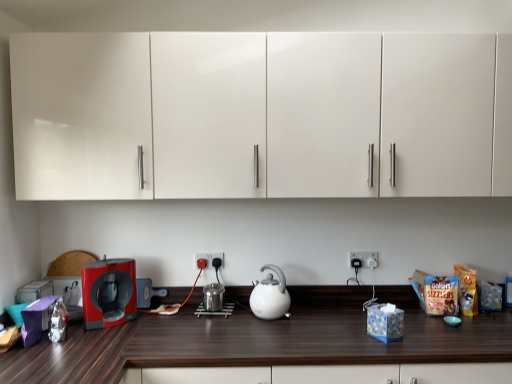
The width and height of the screenshot is (512, 384). What do you see at coordinates (209, 258) in the screenshot?
I see `black plastic electric outlet at center, the first electric outlet viewed from the left` at bounding box center [209, 258].

What do you see at coordinates (261, 115) in the screenshot? The height and width of the screenshot is (384, 512). I see `white glossy cabinets at upper center` at bounding box center [261, 115].

This screenshot has width=512, height=384. What do you see at coordinates (270, 295) in the screenshot? I see `white glossy kettle at center` at bounding box center [270, 295].

Where is `white glossy kettle at center`? This screenshot has height=384, width=512. white glossy kettle at center is located at coordinates 270,295.

This screenshot has height=384, width=512. What do you see at coordinates (364, 258) in the screenshot? I see `white plastic electric outlet at center, marked as the 1th electric outlet in a right-to-left arrangement` at bounding box center [364, 258].

The image size is (512, 384). In order to click on dark wood countertop at lower center in this screenshot , I will do 262,339.

The width and height of the screenshot is (512, 384). In order to click on red glossy coffee machine at left in this screenshot , I will do `click(109, 292)`.

Locate an element on the screen. The height and width of the screenshot is (384, 512). black plastic electric outlet at center, marked as the second electric outlet in a right-to-left arrangement is located at coordinates (209, 258).

From the image's perspective, does white glossy kettle at center appear lower than red glossy coffee machine at left?

Yes, from the image's perspective, white glossy kettle at center is beneath red glossy coffee machine at left.

Which object is thinner, white glossy kettle at center or red glossy coffee machine at left?

red glossy coffee machine at left.

Can you confirm if white glossy kettle at center is positioned to the left of red glossy coffee machine at left?

No, white glossy kettle at center is not to the left of red glossy coffee machine at left.

From a real-world perspective, between white glossy kettle at center and red glossy coffee machine at left, who is vertically higher?

red glossy coffee machine at left.

Between white glossy cabinets at upper center and white glossy kettle at center, which one is positioned in front?

white glossy cabinets at upper center is closer to the camera.

From the picture: From a real-world perspective, relative to white glossy kettle at center, is white glossy cabinets at upper center vertically above or below?

white glossy cabinets at upper center is situated higher than white glossy kettle at center in the real world.

From their relative heights in the image, would you say white glossy cabinets at upper center is taller or shorter than white glossy kettle at center?

Clearly, white glossy cabinets at upper center is taller compared to white glossy kettle at center.

Image resolution: width=512 pixels, height=384 pixels. Identify the location of kitchen appliance below the white glossy cabinets at upper center (from a real-world perspective). click(x=270, y=295).

From a real-world perspective, between white plastic electric outlet at center, marked as the 1th electric outlet in a right-to-left arrangement, and white glossy kettle at center, who is vertically higher?

In real-world perspective, white plastic electric outlet at center, marked as the 1th electric outlet in a right-to-left arrangement, is above.

Based on the photo, considering the relative sizes of white plastic electric outlet at center, marked as the 1th electric outlet in a right-to-left arrangement, and white glossy kettle at center in the image provided, is white plastic electric outlet at center, marked as the 1th electric outlet in a right-to-left arrangement, bigger than white glossy kettle at center?

No.

Does white plastic electric outlet at center, marked as the 1th electric outlet in a right-to-left arrangement, have a lesser width compared to white glossy kettle at center?

Indeed, white plastic electric outlet at center, marked as the 1th electric outlet in a right-to-left arrangement, has a lesser width compared to white glossy kettle at center.

Is white plastic electric outlet at center, acting as the second electric outlet starting from the left, taller than dark wood countertop at lower center?

No.

From the image's perspective, is white plastic electric outlet at center, marked as the 1th electric outlet in a right-to-left arrangement, located above or below dark wood countertop at lower center?

white plastic electric outlet at center, marked as the 1th electric outlet in a right-to-left arrangement, is above dark wood countertop at lower center.

Where is `electric outlet on the right of dark wood countertop at lower center`? electric outlet on the right of dark wood countertop at lower center is located at coordinates (364, 258).

Is white plastic electric outlet at center, marked as the 1th electric outlet in a right-to-left arrangement, turned away from dark wood countertop at lower center?

No.

Between dark wood countertop at lower center and white plastic electric outlet at center, acting as the second electric outlet starting from the left, which one appears on the right side from the viewer's perspective?

Positioned to the right is white plastic electric outlet at center, acting as the second electric outlet starting from the left.

Relative to white plastic electric outlet at center, acting as the second electric outlet starting from the left, is dark wood countertop at lower center in front or behind?

dark wood countertop at lower center is positioned closer to the viewer than white plastic electric outlet at center, acting as the second electric outlet starting from the left.

From a real-world perspective, is dark wood countertop at lower center below white plastic electric outlet at center, marked as the 1th electric outlet in a right-to-left arrangement?

Yes, from a real-world perspective, dark wood countertop at lower center is below white plastic electric outlet at center, marked as the 1th electric outlet in a right-to-left arrangement.

Between white glossy kettle at center and white glossy cabinets at upper center, which one has smaller size?

With smaller size is white glossy kettle at center.

Is white glossy cabinets at upper center a part of white glossy kettle at center?

No, white glossy cabinets at upper center is not surrounded by white glossy kettle at center.

Is point (270, 318) positioned in front of point (134, 198)?

No, (270, 318) is behind (134, 198).

Visually, is white glossy kettle at center positioned to the left or to the right of white glossy cabinets at upper center?

Clearly, white glossy kettle at center is on the left of white glossy cabinets at upper center in the image.

Between white glossy cabinets at upper center and white plastic electric outlet at center, marked as the 1th electric outlet in a right-to-left arrangement, which one has less height?

white plastic electric outlet at center, marked as the 1th electric outlet in a right-to-left arrangement.

Considering the sizes of objects white glossy cabinets at upper center and white plastic electric outlet at center, acting as the second electric outlet starting from the left, in the image provided, who is wider, white glossy cabinets at upper center or white plastic electric outlet at center, acting as the second electric outlet starting from the left,?

white glossy cabinets at upper center.

Could you tell me if white glossy cabinets at upper center is facing white plastic electric outlet at center, marked as the 1th electric outlet in a right-to-left arrangement?

No, white glossy cabinets at upper center is not turned towards white plastic electric outlet at center, marked as the 1th electric outlet in a right-to-left arrangement.

Are white glossy cabinets at upper center and white plastic electric outlet at center, marked as the 1th electric outlet in a right-to-left arrangement, located far from each other?

No, white glossy cabinets at upper center is not far from white plastic electric outlet at center, marked as the 1th electric outlet in a right-to-left arrangement.

Find the location of a particular element. The height and width of the screenshot is (384, 512). kitchen appliance lying behind the red glossy coffee machine at left is located at coordinates (270, 295).

Find the location of a particular element. The height and width of the screenshot is (384, 512). cabinetry that appears in front of the white glossy kettle at center is located at coordinates (261, 115).

Which object lies further to the anchor point white glossy kettle at center, red glossy coffee machine at left or white glossy cabinets at upper center?

white glossy cabinets at upper center.

Which object lies further to the anchor point dark wood countertop at lower center, white glossy cabinets at upper center or red glossy coffee machine at left?

white glossy cabinets at upper center is further to dark wood countertop at lower center.

Which object lies further to the anchor point white glossy kettle at center, red glossy coffee machine at left or dark wood countertop at lower center?

red glossy coffee machine at left.

From the picture: Considering their positions, is white glossy kettle at center positioned further to white glossy cabinets at upper center than red glossy coffee machine at left?

white glossy kettle at center.

Estimate the real-world distances between objects in this image. Which object is closer to black plastic electric outlet at center, the first electric outlet viewed from the left, white plastic electric outlet at center, marked as the 1th electric outlet in a right-to-left arrangement, or red glossy coffee machine at left?

red glossy coffee machine at left is closer to black plastic electric outlet at center, the first electric outlet viewed from the left.

When comparing their distances from white glossy cabinets at upper center, does white glossy kettle at center or white plastic electric outlet at center, marked as the 1th electric outlet in a right-to-left arrangement, seem further?

white plastic electric outlet at center, marked as the 1th electric outlet in a right-to-left arrangement.

Looking at the image, which one is located further to red glossy coffee machine at left, dark wood countertop at lower center or black plastic electric outlet at center, marked as the second electric outlet in a right-to-left arrangement?

black plastic electric outlet at center, marked as the second electric outlet in a right-to-left arrangement.

Considering their positions, is red glossy coffee machine at left positioned closer to dark wood countertop at lower center than white glossy cabinets at upper center?

Among the two, red glossy coffee machine at left is located nearer to dark wood countertop at lower center.

Find the location of `cabinetry located between black plastic electric outlet at center, the first electric outlet viewed from the left, and white plastic electric outlet at center, marked as the 1th electric outlet in a right-to-left arrangement, in the left-right direction`. cabinetry located between black plastic electric outlet at center, the first electric outlet viewed from the left, and white plastic electric outlet at center, marked as the 1th electric outlet in a right-to-left arrangement, in the left-right direction is located at coordinates (261, 115).

The height and width of the screenshot is (384, 512). Identify the location of kitchen appliance between dark wood countertop at lower center and white plastic electric outlet at center, acting as the second electric outlet starting from the left, in the front-back direction. (270, 295).

Locate an element on the screen. The width and height of the screenshot is (512, 384). electric outlet located between red glossy coffee machine at left and white plastic electric outlet at center, acting as the second electric outlet starting from the left, in the left-right direction is located at coordinates (209, 258).

You are a GUI agent. You are given a task and a screenshot of the screen. Output one action in this format:
    pyautogui.click(x=<x>, y=<y>)
    Task: Click on the kitchen appliance between white glossy cabinets at upper center and dark wood countertop at lower center in the up-down direction
    
    Given the screenshot: What is the action you would take?
    pyautogui.click(x=270, y=295)